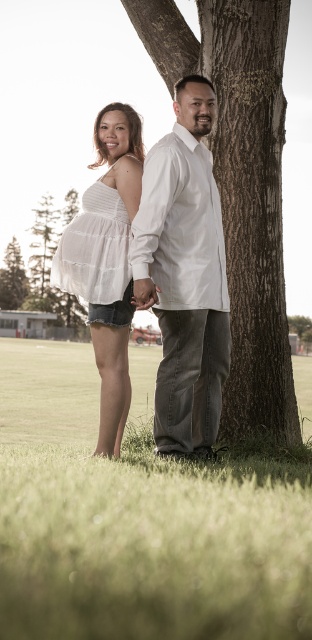
You are a photographer planning to take a photo of the scene. You want to ensure the green grass at lower center is visible beneath the white cotton dress at left. Is this possible based on their positions?

Yes, the green grass at lower center is positioned under the white cotton dress at left, so it should be visible in the photo.

In the scene shown: You are planning to take a photo of the scene. To ensure both the green grass at lower center and the white cotton dress at left are in the frame, where should you position the camera relative to the dress?

Position the camera to the left of the white cotton dress at left so that the green grass at lower center, which is to the right of the dress, remains visible in the frame.

You are a photographer setting up for a photoshoot in the park. You notice two garments hanging on a branch at center. The garments are the white cotton shirt at center and the white sheer dress at center. You want to ensure the dress is visible in the photo. Which garment should you adjust to achieve this?

The white cotton shirt at center is positioned over the white sheer dress at center. To make the dress visible, you should adjust the white cotton shirt at center to move it aside or reposition it so it no longer blocks the dress.